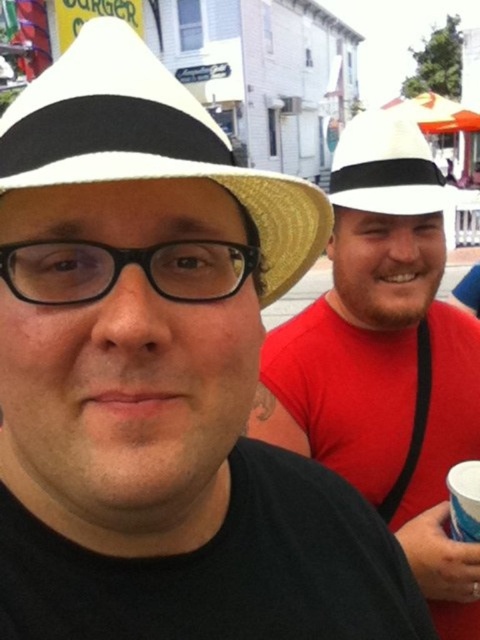
You are at a social gathering and want to take a photo of the person in the foreground wearing a straw hat with a black band and a black shirt. If you move 3 feet closer to the point at coordinates (415, 177), will you be within 3 feet of that point?

The point at coordinates (415, 177) is 5.78 feet away from the camera. Moving 3 feet closer would bring you to 2.78 feet away from the point, which is within the 3 feet distance. Yes, you will be within 3 feet of that point.

You are a hat designer observing the two hats in the image. The white matte fedora at right and the straw hat at center. Which hat has a larger size?

The white matte fedora at right has a larger size compared to the straw hat at center.

You are a photographer trying to capture both the white matte fedora at right and the straw hat at center in a single frame. Which hat will appear larger in the photo?

The white matte fedora at right is taller than the straw hat at center, so it will appear larger in the photo.